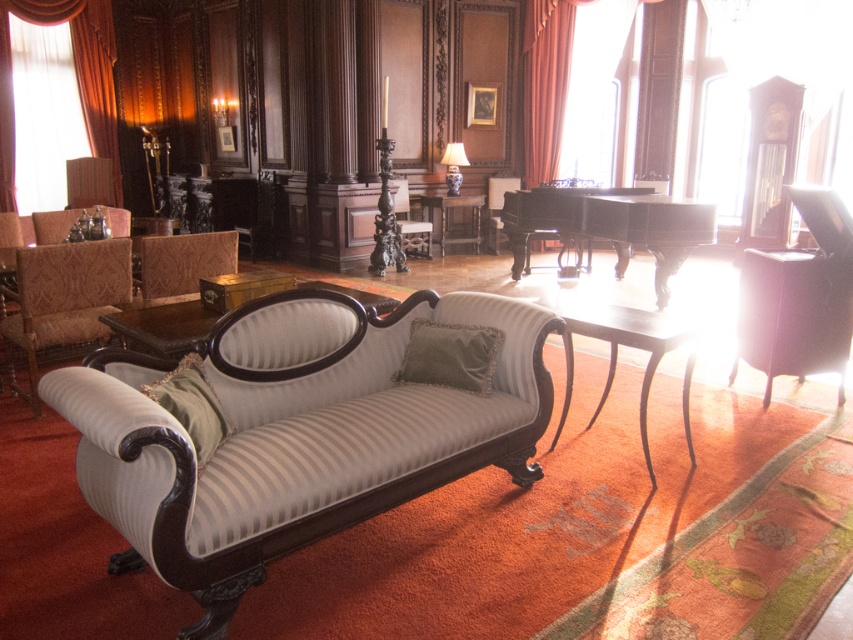
Does black polished wood piano at center have a smaller size compared to velvet drapery at upper right?

No.

Does point (579, 236) come in front of point (556, 24)?

Yes, point (579, 236) is closer to viewer.

Image resolution: width=853 pixels, height=640 pixels. I want to click on black polished wood piano at center, so click(x=612, y=225).

Does striped fabric couch at center appear on the left side of patterned fabric armchair at left?

Incorrect, striped fabric couch at center is not on the left side of patterned fabric armchair at left.

Consider the image. Is striped fabric couch at center bigger than patterned fabric armchair at left?

Correct, striped fabric couch at center is larger in size than patterned fabric armchair at left.

Who is more forward, (366,445) or (236,260)?

Point (366,445)

The width and height of the screenshot is (853, 640). Find the location of `striped fabric couch at center`. striped fabric couch at center is located at coordinates (294, 433).

Between point (91, 308) and point (477, 364), which one is positioned behind?

The point (91, 308) is behind.

Is damask fabric armchair at left below velvet green pillow at center?

Actually, damask fabric armchair at left is above velvet green pillow at center.

You are a GUI agent. You are given a task and a screenshot of the screen. Output one action in this format:
    pyautogui.click(x=<x>, y=<y>)
    Task: Click on the damask fabric armchair at left
    
    Given the screenshot: What is the action you would take?
    (x=62, y=300)